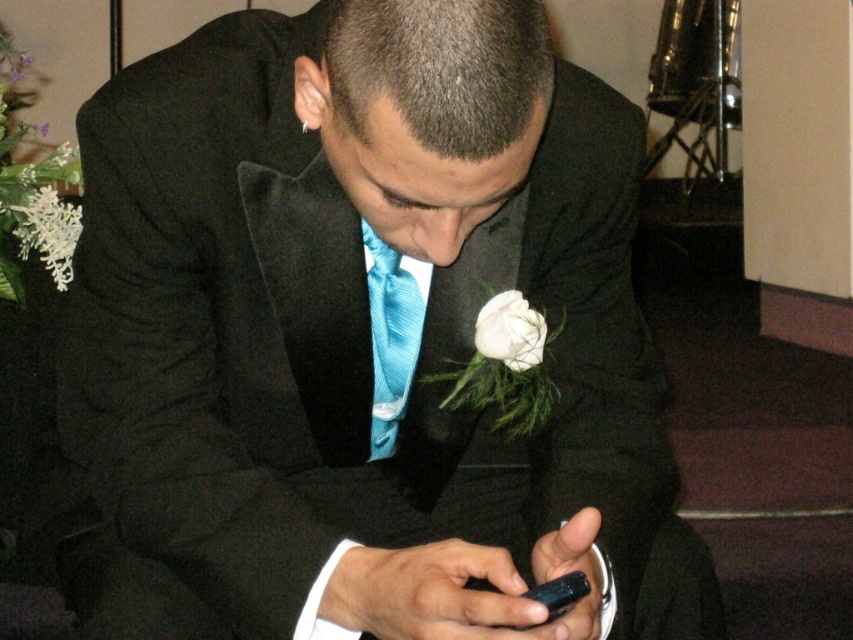
You are standing in the reception area and need to determine which of the two points, point [390,324] or point [508,342], is closer to you. Based on the image, which point is nearer?

Point [390,324] is closer to you because it is further to the viewer than point [508,342].

You are a florist arranging flowers for a wedding. You have two flowers to place in a vase. The white silk flower at center and the white matte flower at upper left. According to the image, which flower should you place on the right side of the arrangement?

The white silk flower at center should be placed on the right side of the arrangement because it is already positioned to the right of the white matte flower at upper left in the image.

You are at a wedding reception and see a man in a tuxedo holding a smartphone. There is a point marked at coordinates (392, 337). Based on the scene description, where is this point located?

The point is located on the blue striped tie at center.